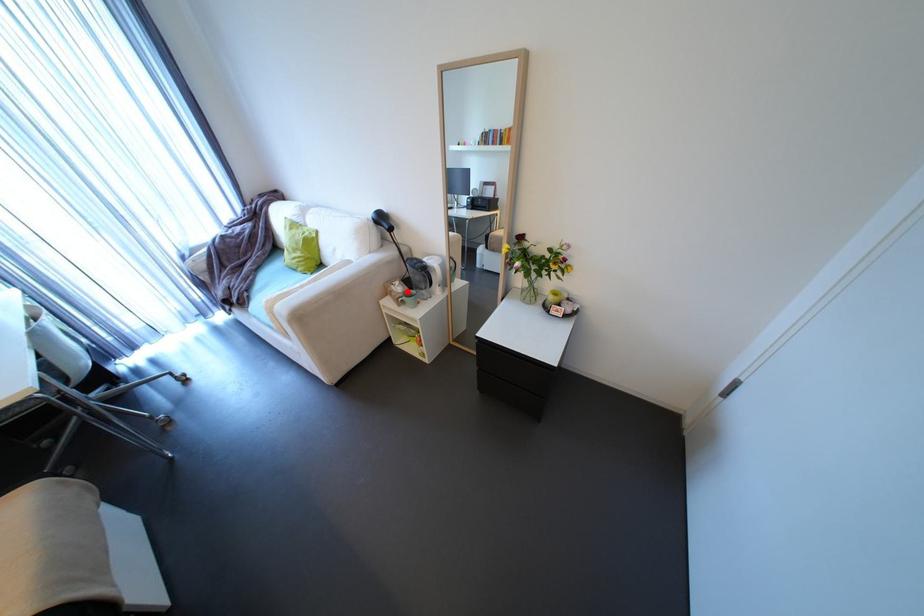
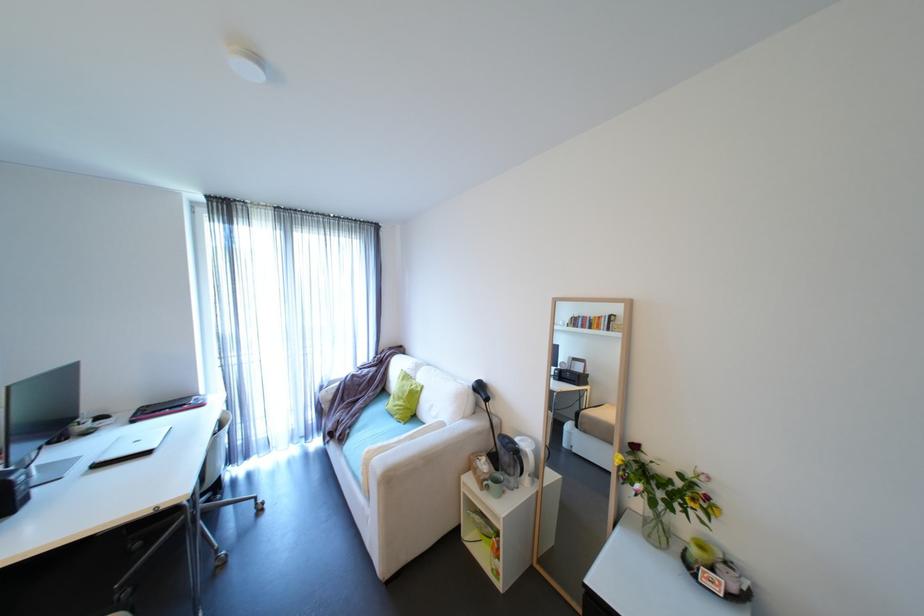
Question: A red point is marked in image1. In image2, is the corresponding 3D point closer to the camera or farther? Reply with the corresponding letter.

Choices:
 (A) The corresponding 3D point is closer.
 (B) The corresponding 3D point is farther.

Answer: (B)